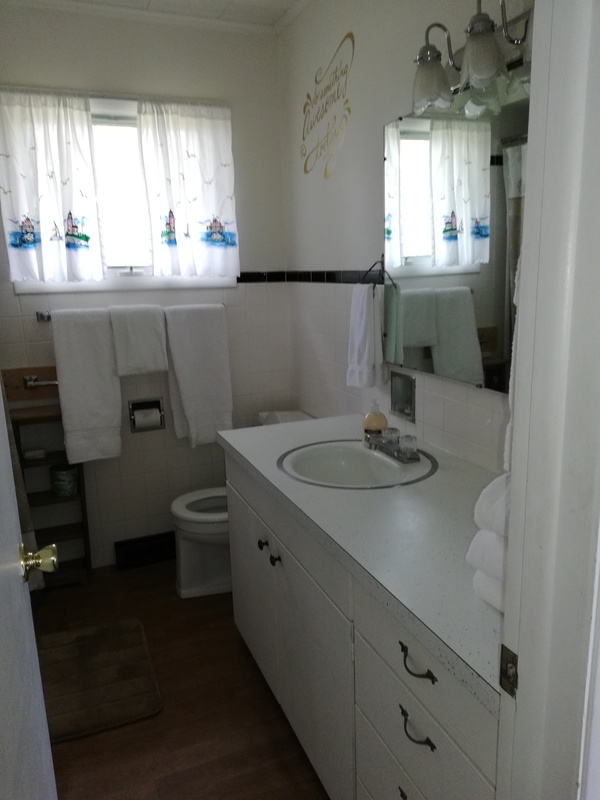
Where is `trim`? The image size is (600, 800). trim is located at coordinates (325, 274).